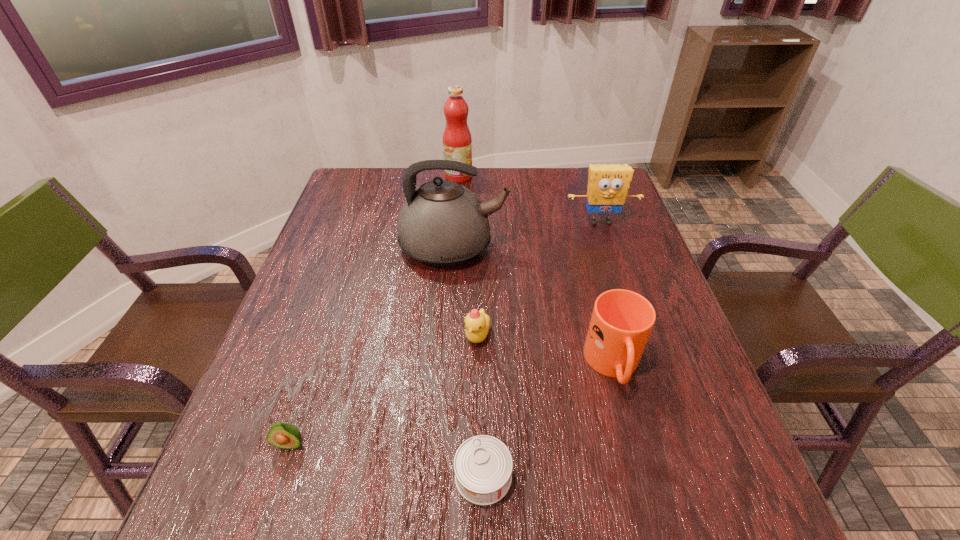
This screenshot has width=960, height=540. In order to click on unoccupied position between the duckling and the mug in this screenshot , I will do `click(545, 350)`.

I want to click on free space between the mug and the shortest object, so click(x=548, y=421).

You are a GUI agent. You are given a task and a screenshot of the screen. Output one action in this format:
    pyautogui.click(x=<x>, y=<y>)
    Task: Click on the vacant area between the fruit juice and the sponge
    This screenshot has width=960, height=540.
    Given the screenshot: What is the action you would take?
    pyautogui.click(x=530, y=199)

Locate an element on the screen. Image resolution: width=960 pixels, height=540 pixels. object that can be found as the third closest to the third tallest object is located at coordinates (622, 320).

Select which object is the fifth closest to the farthest object. Please provide its 2D coordinates. Your answer should be formatted as a tuple, i.e. [(x, y)], where the tuple contains the x and y coordinates of a point satisfying the conditions above.

[(283, 435)]

Locate an element on the screen. The width and height of the screenshot is (960, 540). free spot that satisfies the following two spatial constraints: 1. on the front label of the can; 2. on the right side of the fruit juice is located at coordinates coord(438,476).

Image resolution: width=960 pixels, height=540 pixels. What are the coordinates of `vacant space that satisfies the following two spatial constraints: 1. on the front label of the shortest object; 2. on the right side of the fruit juice` in the screenshot? It's located at (x=438, y=476).

At what (x,y) coordinates should I click in order to perform the action: click on free location that satisfies the following two spatial constraints: 1. at the spout of the kettle; 2. on the cut side of the avocado. Please return your answer as a coordinate pair (x, y). The image size is (960, 540). Looking at the image, I should click on (441, 443).

Locate an element on the screen. This screenshot has width=960, height=540. vacant area that satisfies the following two spatial constraints: 1. on the front label of the fruit juice; 2. on the right side of the can is located at coordinates tap(438, 476).

The width and height of the screenshot is (960, 540). What are the coordinates of `vacant space that satisfies the following two spatial constraints: 1. at the spout of the shortest object; 2. on the left side of the kettle` in the screenshot? It's located at (438, 476).